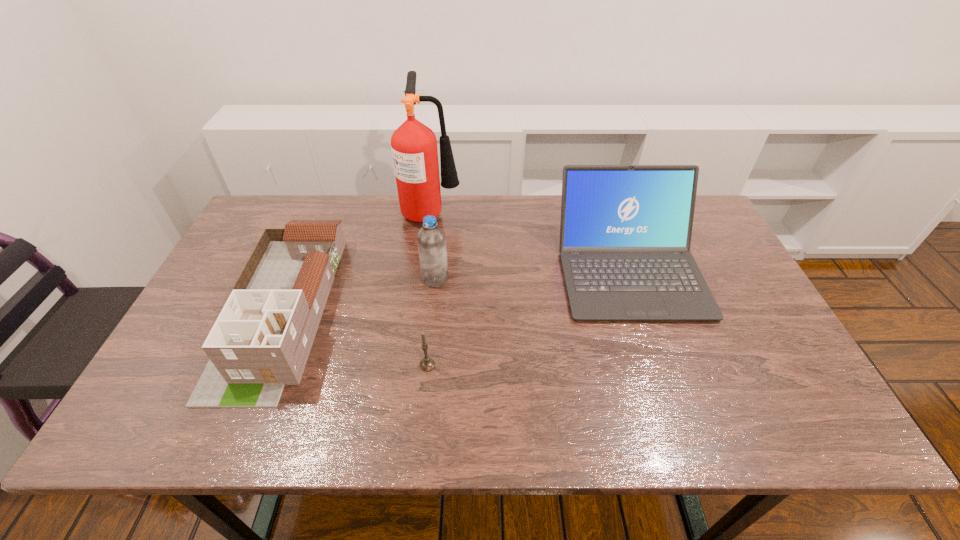
In the image, there is a desktop. Where is `vacant space at the left edge`? The width and height of the screenshot is (960, 540). vacant space at the left edge is located at coordinates (191, 366).

Identify the location of free point at the right edge. (735, 279).

The height and width of the screenshot is (540, 960). Find the location of `free location at the far left corner of the desktop`. free location at the far left corner of the desktop is located at coordinates (259, 218).

Identify the location of empty location between the rightmost object and the candle. This screenshot has height=540, width=960. (528, 318).

The height and width of the screenshot is (540, 960). I want to click on free spot between the shortest object and the water bottle, so click(x=431, y=322).

Locate an element on the screen. Image resolution: width=960 pixels, height=540 pixels. free space between the shortest object and the water bottle is located at coordinates (431, 322).

Where is `free point between the second shortest object and the shortest object`? free point between the second shortest object and the shortest object is located at coordinates (354, 338).

Identify the location of free space between the leftmost object and the candle. The height and width of the screenshot is (540, 960). (354, 338).

The width and height of the screenshot is (960, 540). What are the coordinates of `free spot between the leftmost object and the fire extinguisher` in the screenshot? It's located at (356, 261).

The height and width of the screenshot is (540, 960). What are the coordinates of `unoccupied area between the water bottle and the leftmost object` in the screenshot? It's located at (358, 295).